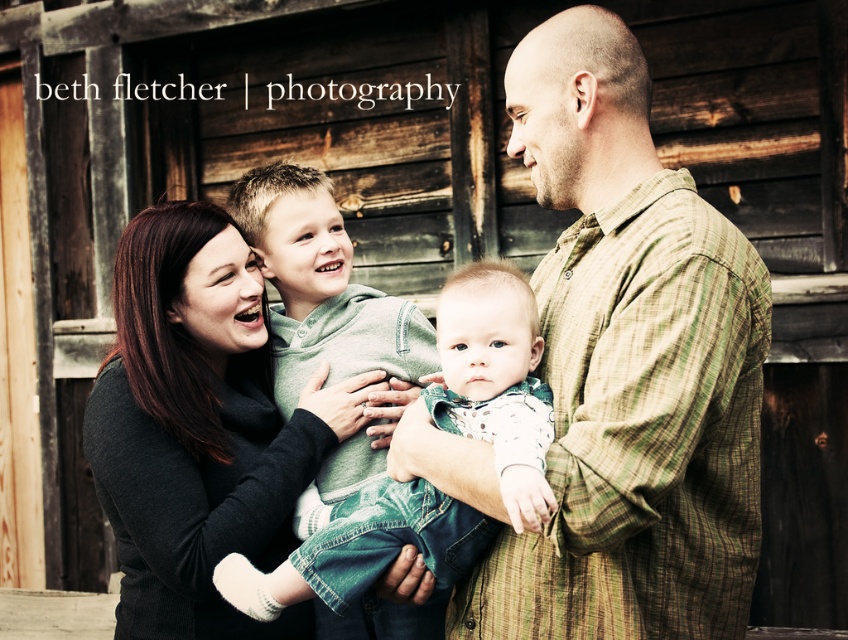
You are a photographer trying to adjust your camera to focus on both the green plaid shirt at center and the matte black sweater at center. Which object should you focus on first if you want to ensure both are in focus, considering their sizes?

The green plaid shirt at center is taller than the matte black sweater at center, so you should focus on the green plaid shirt at center first to ensure both are in focus.

You are trying to decide which sweater to take for a chilly day. Both the matte black sweater at center and the soft white knit sweater at center are available. Based on their sizes, which one would you choose?

The matte black sweater at center is bigger than the soft white knit sweater at center, so you should choose the matte black sweater at center for a chillier day as it provides more warmth due to its larger size.

You are a photographer trying to capture a photo of the family. You need to ensure that both the green plaid shirt at center and the soft white knit sweater at center are clearly visible in the frame. Based on their positions, which clothing item is positioned higher up in the image?

The green plaid shirt at center is much taller as the soft white knit sweater at center, so the green plaid shirt at center is positioned higher up in the image.